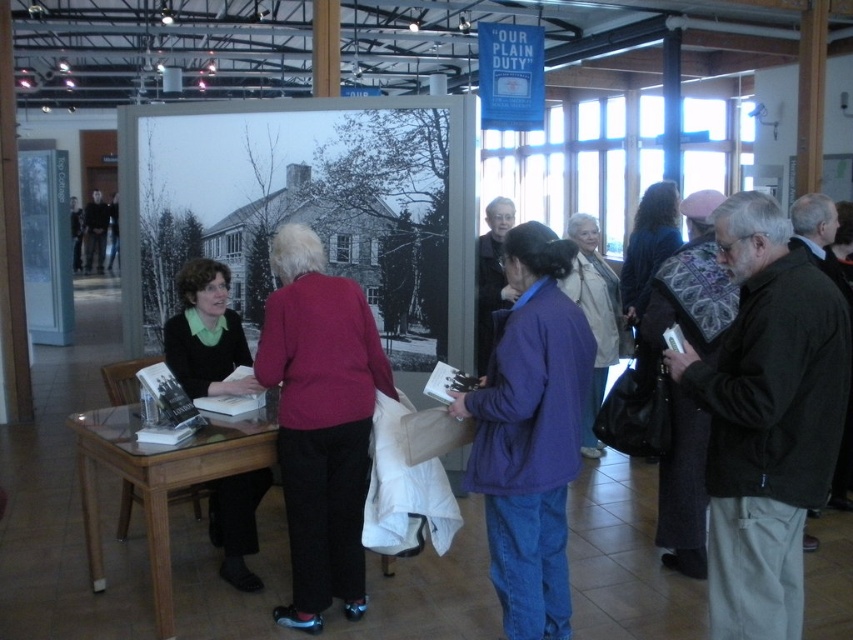
Which of these two, dark brown jacket at center or clear glass table at lower left, stands shorter?

Standing shorter between the two is clear glass table at lower left.

Measure the distance between dark brown jacket at center and clear glass table at lower left.

1.78 meters

Which is behind, point (733, 518) or point (93, 476)?

The point (93, 476) is more distant.

The image size is (853, 640). I want to click on dark brown jacket at center, so click(x=766, y=419).

Is dark brown jacket at center below purple matte jacket at center?

No, dark brown jacket at center is not below purple matte jacket at center.

Can you confirm if dark brown jacket at center is smaller than purple matte jacket at center?

Indeed, dark brown jacket at center has a smaller size compared to purple matte jacket at center.

Measure the distance between dark brown jacket at center and camera.

6.99 feet

You are a GUI agent. You are given a task and a screenshot of the screen. Output one action in this format:
    pyautogui.click(x=<x>, y=<y>)
    Task: Click on the dark brown jacket at center
    This screenshot has width=853, height=640.
    Given the screenshot: What is the action you would take?
    pyautogui.click(x=766, y=419)

Is purple matte jacket at center positioned in front of clear glass table at lower left?

Yes.

Who is more distant from viewer, (535, 248) or (186, 461)?

Positioned behind is point (186, 461).

Is point (512, 550) positioned after point (268, 452)?

No.

The height and width of the screenshot is (640, 853). Identify the location of purple matte jacket at center. (531, 433).